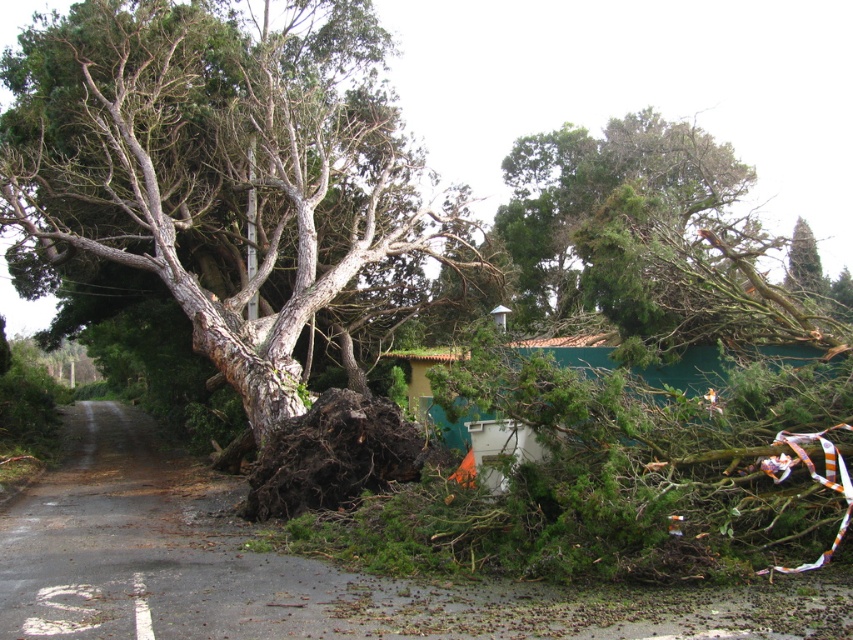
Is point (231, 109) in front of point (820, 296)?

Yes, point (231, 109) is closer to viewer.

You are a GUI agent. You are given a task and a screenshot of the screen. Output one action in this format:
    pyautogui.click(x=<x>, y=<y>)
    Task: Click on the brown rough bark tree at center
    This screenshot has height=640, width=853.
    Given the screenshot: What is the action you would take?
    click(x=224, y=170)

The image size is (853, 640). I want to click on brown rough bark tree at center, so click(x=224, y=170).